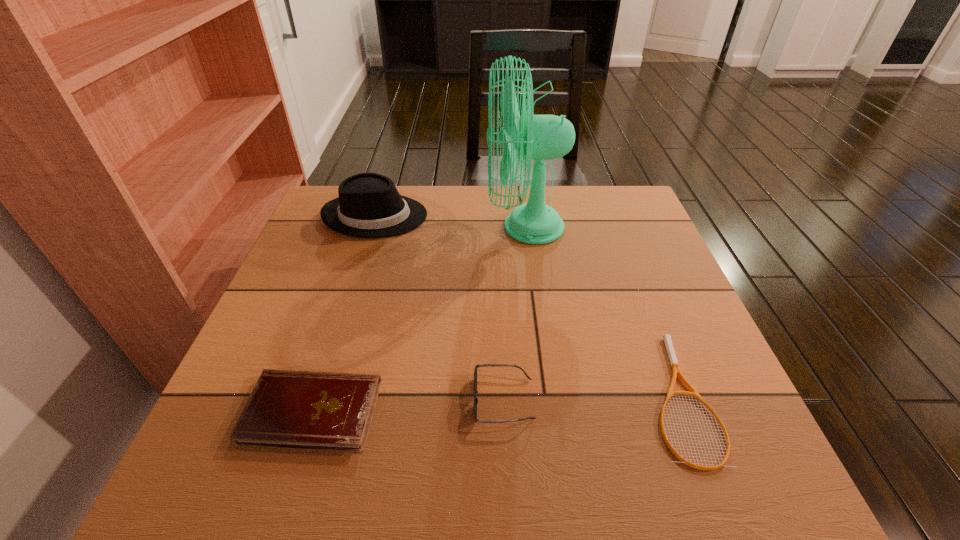
The image size is (960, 540). I want to click on fan, so click(x=540, y=137).

Where is `fedora`? fedora is located at coordinates (369, 205).

This screenshot has height=540, width=960. Find the location of `the third shortest object`. the third shortest object is located at coordinates [479, 365].

Find the location of a particular element. Image resolution: width=960 pixels, height=540 pixels. notebook is located at coordinates (309, 410).

This screenshot has height=540, width=960. I want to click on the shortest object, so click(676, 370).

Locate an element on the screen. This screenshot has width=960, height=540. tennis racket is located at coordinates (676, 370).

This screenshot has height=540, width=960. I want to click on free space located in front of the fan to blow air, so click(x=409, y=227).

Identify the location of free space located 0.100m in front of the fan to blow air. Image resolution: width=960 pixels, height=540 pixels. (449, 227).

Find the location of a particular element. Image resolution: width=960 pixels, height=540 pixels. vacant space situated 0.080m in front of the fan to blow air is located at coordinates (456, 227).

Locate an element on the screen. This screenshot has height=540, width=960. vacant space located on the front-facing side of the fourth shortest object is located at coordinates (523, 216).